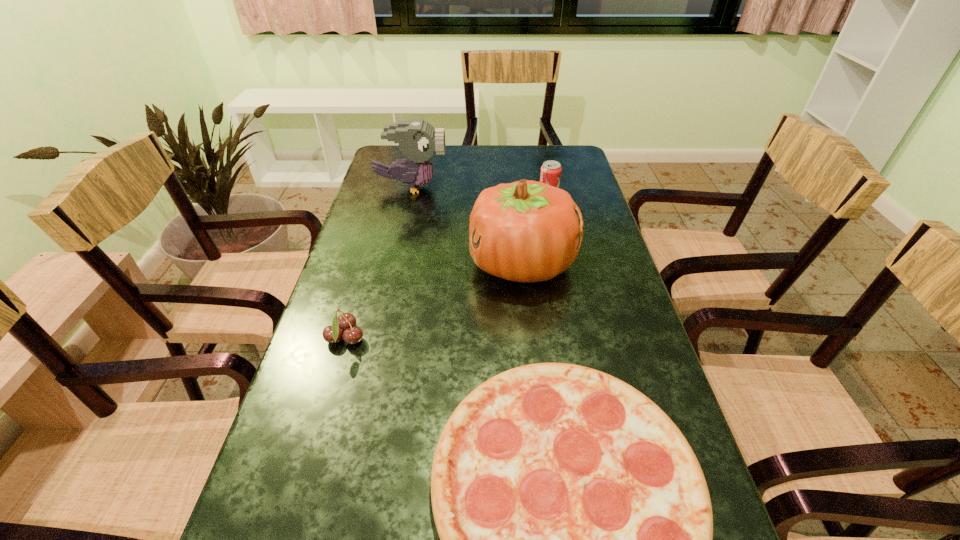
This screenshot has width=960, height=540. Identify the location of vacant point located on the leaves of the second shortest object. (387, 339).

The height and width of the screenshot is (540, 960). Identify the location of bird present at the left edge. (417, 139).

This screenshot has width=960, height=540. In order to click on cherry that is positioned at the left edge in this screenshot , I will do `click(345, 321)`.

Image resolution: width=960 pixels, height=540 pixels. I want to click on pumpkin located at the right edge, so click(527, 231).

The height and width of the screenshot is (540, 960). In order to click on soda can positioned at the right edge in this screenshot , I will do `click(550, 174)`.

What are the coordinates of `free space at the far edge of the desktop` in the screenshot? It's located at point(473,175).

The height and width of the screenshot is (540, 960). In the image, there is a desktop. In order to click on free space at the left edge in this screenshot , I will do `click(388, 195)`.

In the image, there is a desktop. At what (x,y) coordinates should I click in order to perform the action: click on free region at the right edge. Please return your answer as a coordinate pair (x, y). Image resolution: width=960 pixels, height=540 pixels. Looking at the image, I should click on (621, 371).

This screenshot has height=540, width=960. I want to click on vacant space at the far left corner of the desktop, so (389, 159).

The image size is (960, 540). What are the coordinates of `free space between the fourth farthest object and the third tallest object` in the screenshot? It's located at (447, 266).